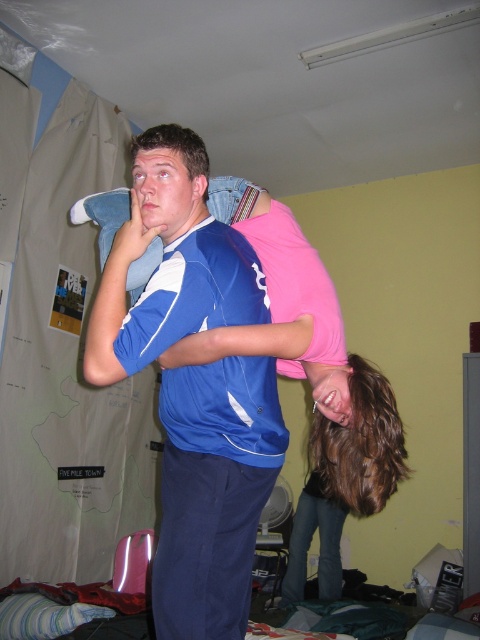
Question: Is blue jersey at center thinner than pink matte shirt at upper center?

Choices:
 (A) no
 (B) yes

Answer: (B)

Question: Which point is farther to the camera?

Choices:
 (A) (213, 326)
 (B) (386, 474)

Answer: (B)

Question: Is blue jersey at center thinner than pink matte shirt at upper center?

Choices:
 (A) yes
 (B) no

Answer: (A)

Question: Does blue jersey at center come behind pink matte shirt at upper center?

Choices:
 (A) no
 (B) yes

Answer: (A)

Question: Among these objects, which one is nearest to the camera?

Choices:
 (A) blue jersey at center
 (B) pink matte shirt at upper center

Answer: (A)